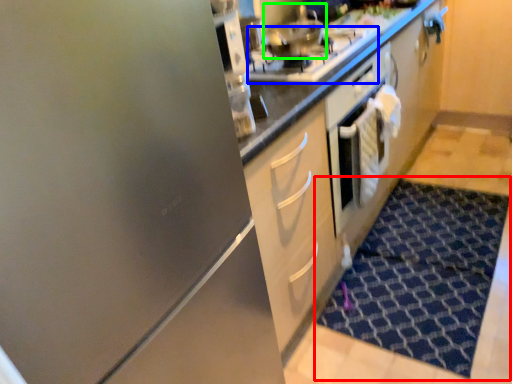
Question: Which object is positioned farthest from doormat (highlighted by a red box)? Select from gas stove (highlighted by a blue box) and stainless steel (highlighted by a green box).

Choices:
 (A) gas stove
 (B) stainless steel

Answer: (B)